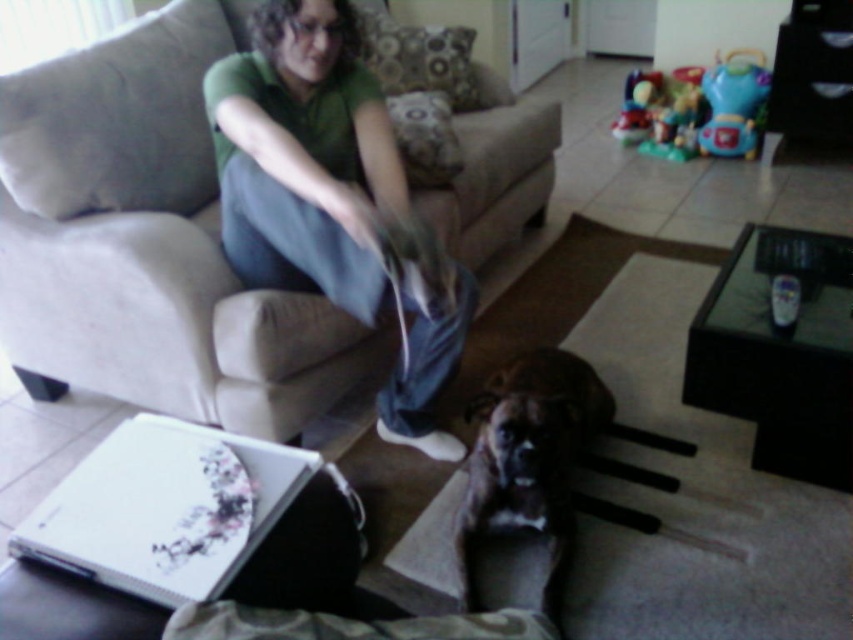
Question: From the image, what is the correct spatial relationship of beige fabric couch at center in relation to brown furry dog at center?

Choices:
 (A) left
 (B) right

Answer: (A)

Question: Which is nearer to the green cotton shirt at center?

Choices:
 (A) brown furry dog at center
 (B) beige fabric couch at center

Answer: (B)

Question: Estimate the real-world distances between objects in this image. Which object is closer to the beige fabric couch at center?

Choices:
 (A) brown furry dog at center
 (B) green cotton shirt at center

Answer: (B)

Question: Which object appears farthest from the camera in this image?

Choices:
 (A) beige fabric couch at center
 (B) green cotton shirt at center
 (C) brown furry dog at center

Answer: (A)

Question: Can you confirm if beige fabric couch at center is smaller than brown furry dog at center?

Choices:
 (A) yes
 (B) no

Answer: (B)

Question: Can you confirm if beige fabric couch at center is smaller than green cotton shirt at center?

Choices:
 (A) yes
 (B) no

Answer: (B)